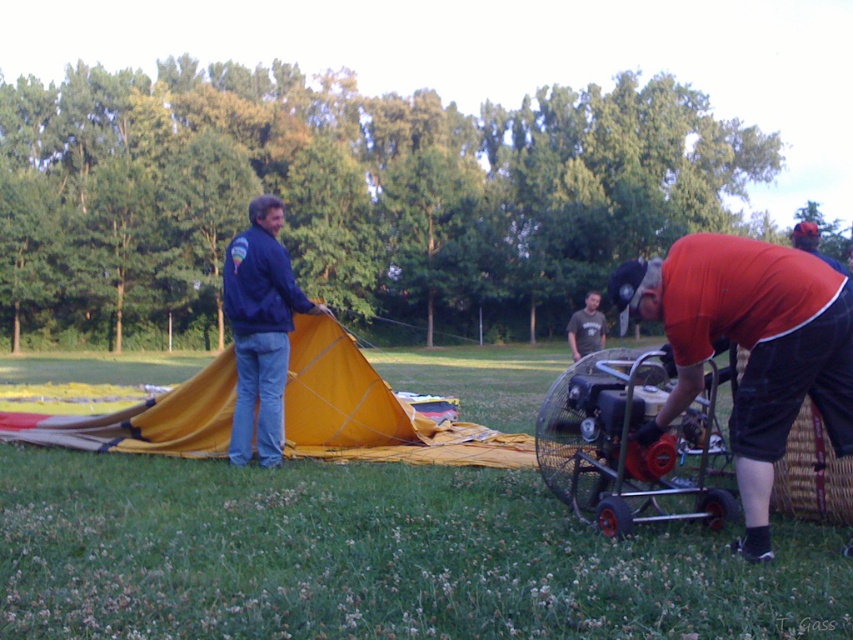
Question: Among these points, which one is farthest from the camera?

Choices:
 (A) (730, 435)
 (B) (576, 349)
 (C) (625, 433)
 (D) (285, 260)

Answer: (B)

Question: Is orange fabric shirt at lower right positioned before yellow fabric tent at left?

Choices:
 (A) yes
 (B) no

Answer: (A)

Question: Does metallic red engine at center have a lesser width compared to dark gray t-shirt at center?

Choices:
 (A) no
 (B) yes

Answer: (B)

Question: Among these objects, which one is nearest to the camera?

Choices:
 (A) metallic red engine at center
 (B) orange fabric shirt at lower right
 (C) yellow fabric tent at left
 (D) matte blue jacket at center

Answer: (B)

Question: From the image, what is the correct spatial relationship of orange fabric shirt at lower right in relation to matte blue jacket at center?

Choices:
 (A) left
 (B) right

Answer: (B)

Question: Which of the following is the farthest from the observer?

Choices:
 (A) (573, 349)
 (B) (770, 269)
 (C) (144, 426)
 (D) (250, 288)

Answer: (A)